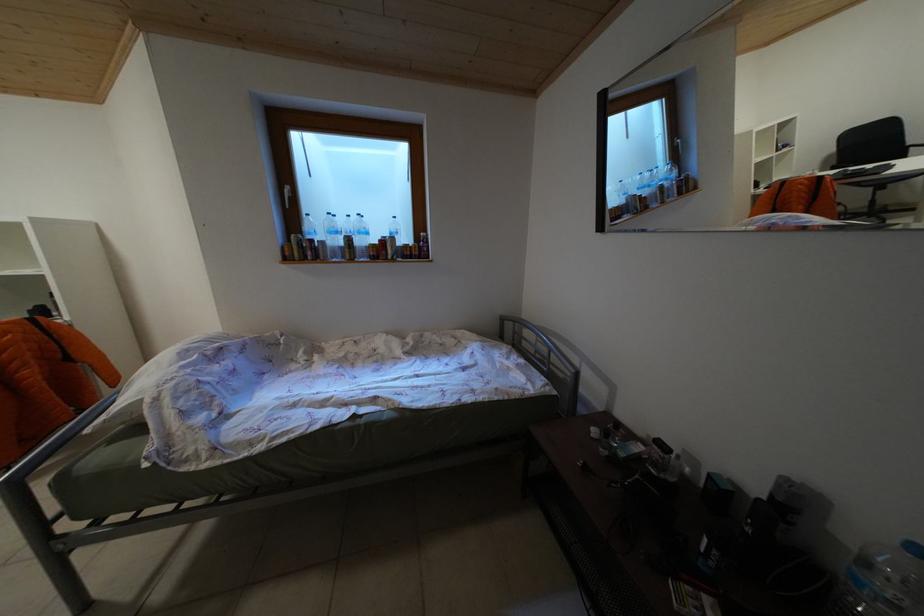
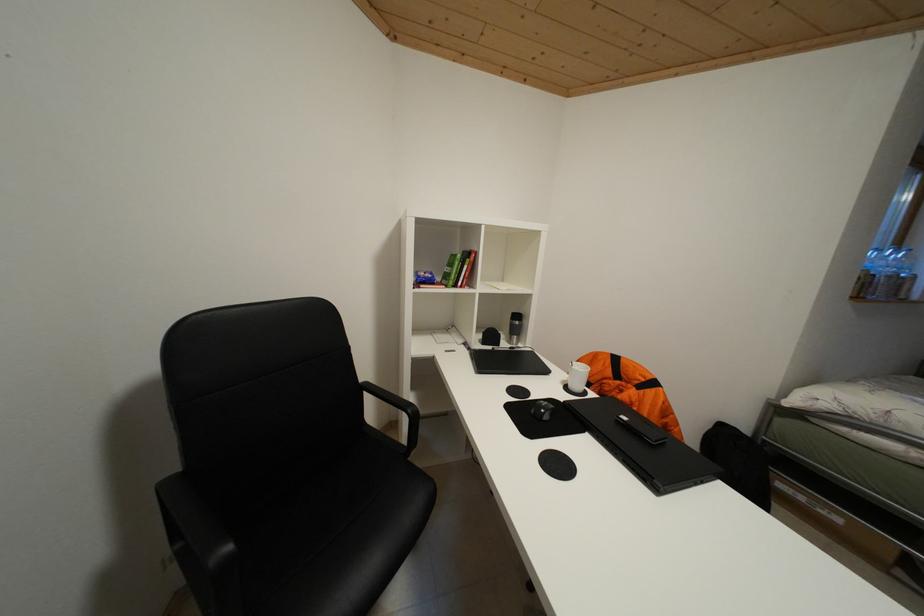
Question: What movement of the cameraman would produce the second image?

Choices:
 (A) Left
 (B) Right
 (C) Forward
 (D) Backward

Answer: (A)